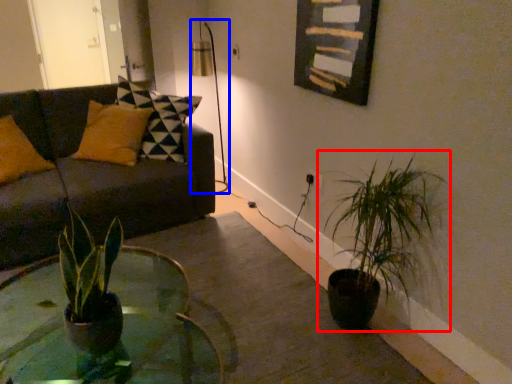
Question: Among these objects, which one is farthest to the camera, houseplant (highlighted by a red box) or table lamp (highlighted by a blue box)?

Choices:
 (A) houseplant
 (B) table lamp

Answer: (B)